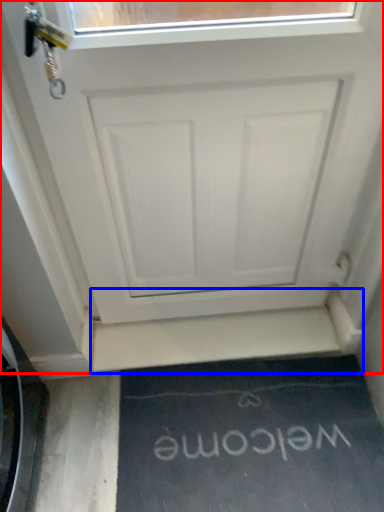
Question: Which object appears farthest to the camera in this image, door (highlighted by a red box) or stairwell (highlighted by a blue box)?

Choices:
 (A) door
 (B) stairwell

Answer: (B)